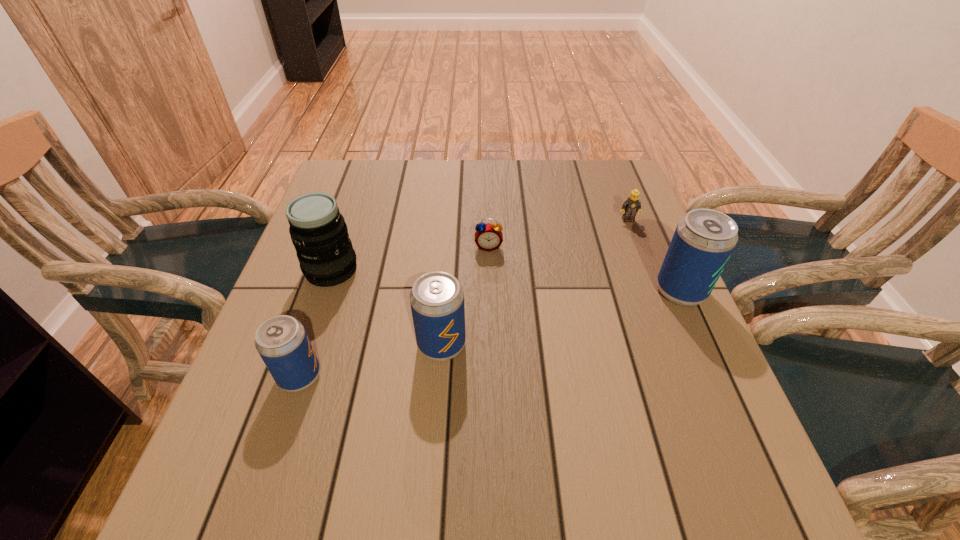
Please point a space for a new beer_can to maintain equal intervals. Please provide its 2D coordinates. Your answer should be formatted as a tuple, i.e. [(x, y)], where the tuple contains the x and y coordinates of a point satisfying the conditions above.

[(567, 316)]